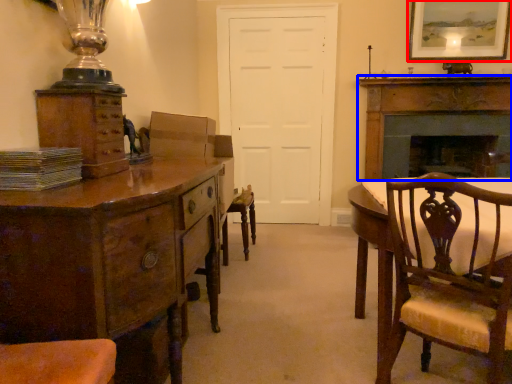
Question: Which object appears farthest to the camera in this image, picture frame (highlighted by a red box) or fireplace (highlighted by a blue box)?

Choices:
 (A) picture frame
 (B) fireplace

Answer: (B)